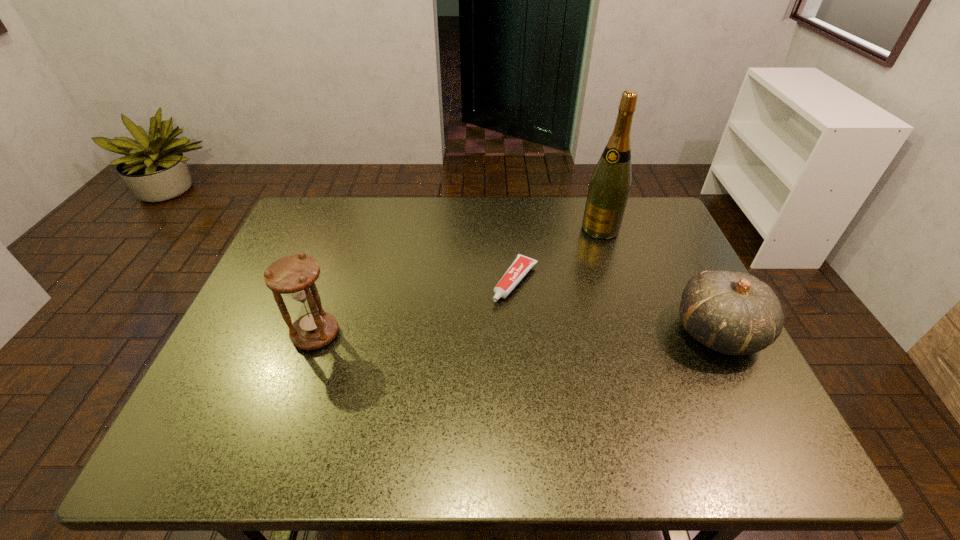
This screenshot has height=540, width=960. Identify the location of vacant area that lies between the gourd and the wine bottle. tap(659, 280).

Image resolution: width=960 pixels, height=540 pixels. I want to click on empty location between the tallest object and the second tallest object, so click(458, 281).

Identify the location of free space between the shortest object and the leftmost object. (416, 308).

Find the location of a particular element. The height and width of the screenshot is (540, 960). vacant space that is in between the toothpaste and the tallest object is located at coordinates [x=558, y=255].

The width and height of the screenshot is (960, 540). What are the coordinates of `free spot between the second object from left to right and the rightmost object` in the screenshot? It's located at (616, 306).

At what (x,y) coordinates should I click in order to perform the action: click on blank region between the rightmost object and the wine bottle. Please return your answer as a coordinate pair (x, y). The image size is (960, 540). Looking at the image, I should click on (659, 280).

Image resolution: width=960 pixels, height=540 pixels. Find the location of `blank region between the third shortest object and the gourd`. blank region between the third shortest object and the gourd is located at coordinates pos(516,333).

At what (x,y) coordinates should I click in order to perform the action: click on object that is the second closest to the leftmost object. Please return your answer as a coordinate pair (x, y). The width and height of the screenshot is (960, 540). Looking at the image, I should click on (609, 188).

Identify which object is located as the third nearest to the rightmost object. Please provide its 2D coordinates. Your answer should be formatted as a tuple, i.e. [(x, y)], where the tuple contains the x and y coordinates of a point satisfying the conditions above.

[(294, 275)]

Locate an element on the screen. The width and height of the screenshot is (960, 540). vacant position in the image that satisfies the following two spatial constraints: 1. on the front side of the toothpaste; 2. on the left side of the second shortest object is located at coordinates (519, 331).